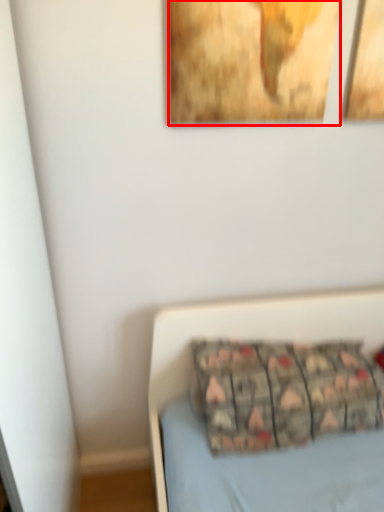
Question: From the image's perspective, where is picture frame (annotated by the red box) located in relation to pillow in the image?

Choices:
 (A) below
 (B) above

Answer: (B)